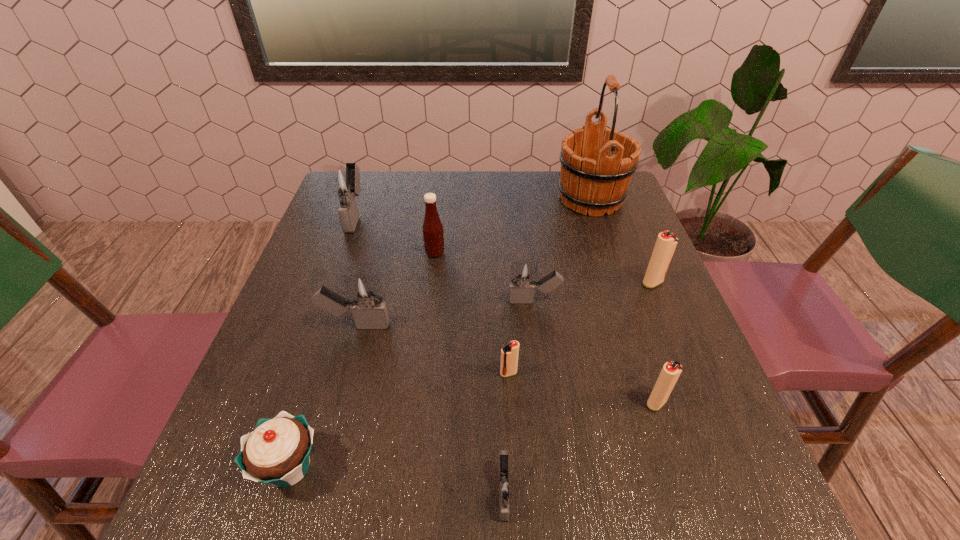
In the image, there is a desktop. In order to click on vacant region at the right edge in this screenshot , I will do `click(731, 470)`.

The image size is (960, 540). Find the location of `free spot at the far left corner of the desktop`. free spot at the far left corner of the desktop is located at coordinates (337, 212).

I want to click on vacant area at the near right corner, so click(746, 479).

You are a GUI agent. You are given a task and a screenshot of the screen. Output one action in this format:
    pyautogui.click(x=<x>, y=<y>)
    Task: Click on the vacant area between the eighth nearest object and the second biggest red igniter
    
    Given the screenshot: What is the action you would take?
    pyautogui.click(x=545, y=328)

In order to click on vacant region between the biggest red igniter and the fifth nearest object in this screenshot , I will do `click(504, 304)`.

Image resolution: width=960 pixels, height=540 pixels. Identify the location of empty space between the wood wine bucket and the rightmost gray igniter. (563, 251).

Identify the location of blank region between the nearest igniter and the fourth nearest igniter. The height and width of the screenshot is (540, 960). (430, 409).

Find the location of a particular element. empty space between the second igniter from right to left and the tallest object is located at coordinates (623, 301).

This screenshot has width=960, height=540. I want to click on free spot between the cupcake and the rightmost red igniter, so click(471, 375).

The image size is (960, 540). Find the location of `free space between the sixth farthest igniter and the nearest igniter`. free space between the sixth farthest igniter and the nearest igniter is located at coordinates (580, 448).